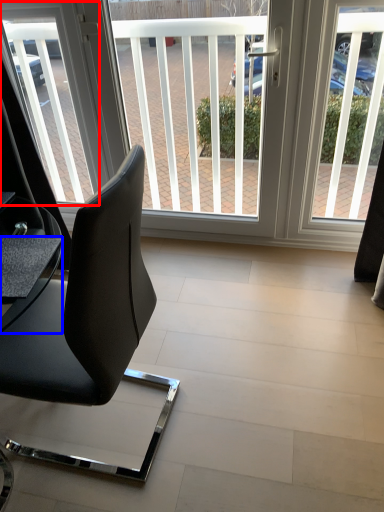
Question: Which object appears farthest to the camera in this image, window screen (highlighted by a red box) or table (highlighted by a blue box)?

Choices:
 (A) window screen
 (B) table

Answer: (A)